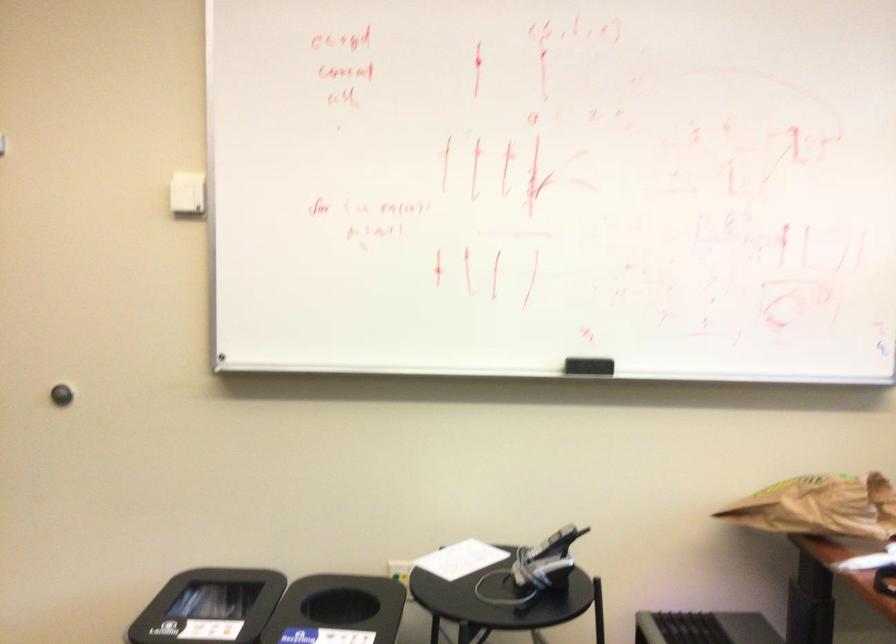
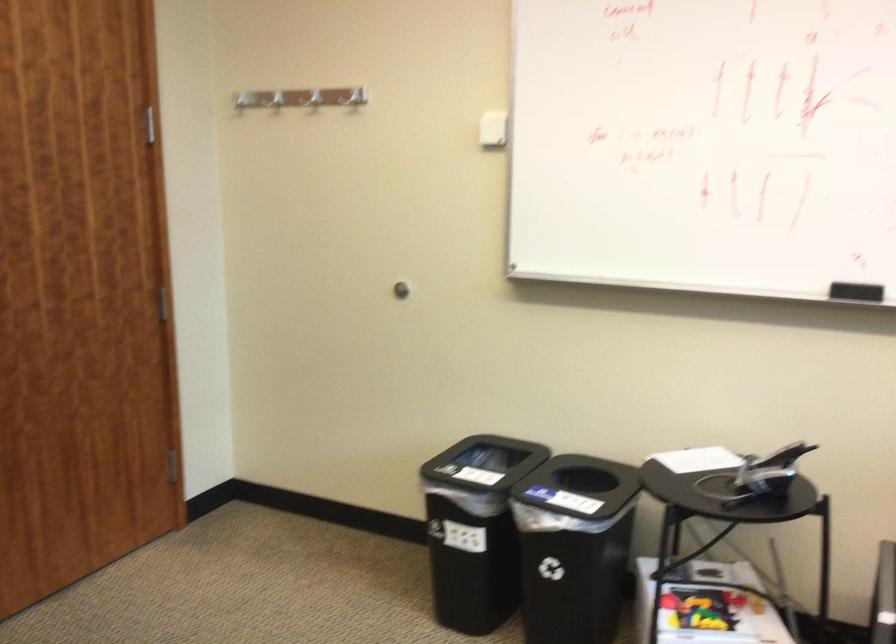
Locate, in the second image, the point that corresponds to the point at 590,371 in the first image.

(856, 292)